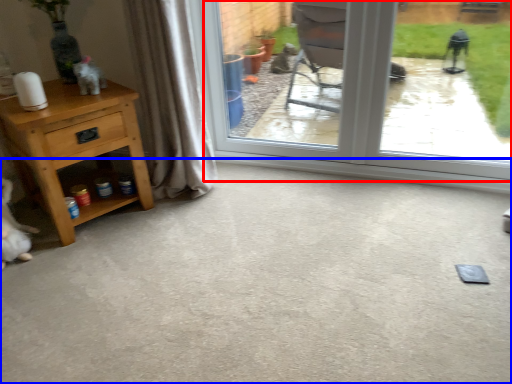
Question: Which point is closer to the camera, window (highlighted by a red box) or concrete (highlighted by a blue box)?

Choices:
 (A) window
 (B) concrete

Answer: (B)